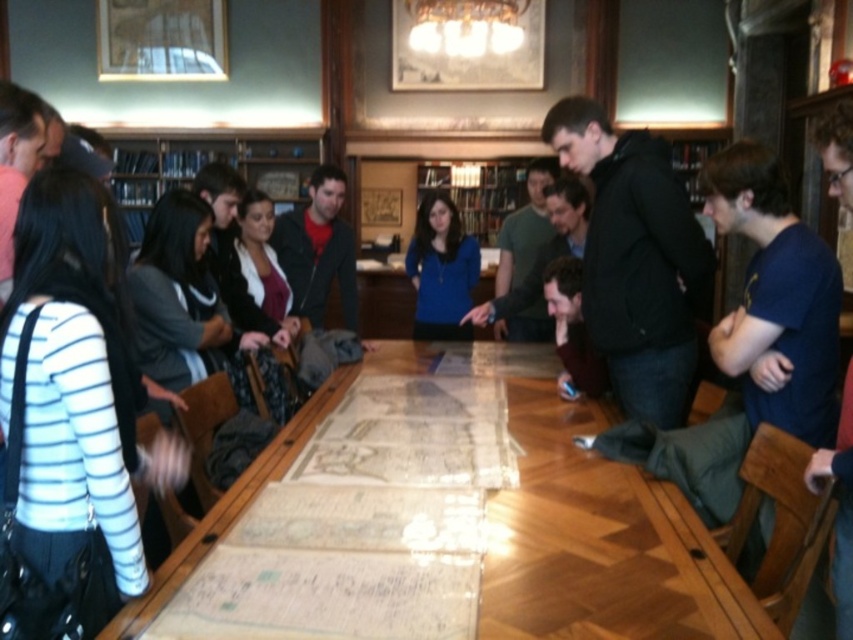
Question: Among these objects, which one is nearest to the camera?

Choices:
 (A) wooden map at center
 (B) blue matte sweater at center

Answer: (A)

Question: Does wooden map at center appear on the right side of blue matte sweater at center?

Choices:
 (A) yes
 (B) no

Answer: (A)

Question: Which point is farther to the camera?

Choices:
 (A) (434, 248)
 (B) (308, 141)
 (C) (575, 624)

Answer: (B)

Question: Among these objects, which one is farthest from the camera?

Choices:
 (A) blue fabric bookshelf at upper center
 (B) wooden map at center

Answer: (A)

Question: Can you confirm if wooden map at center is positioned to the right of blue matte sweater at center?

Choices:
 (A) yes
 (B) no

Answer: (A)

Question: Does wooden map at center appear over blue fabric bookshelf at upper center?

Choices:
 (A) yes
 (B) no

Answer: (B)